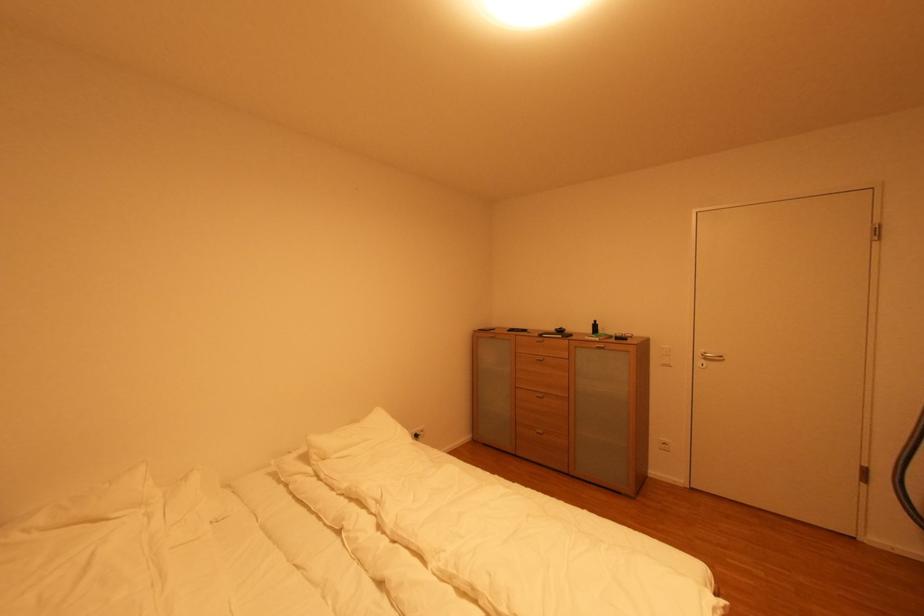
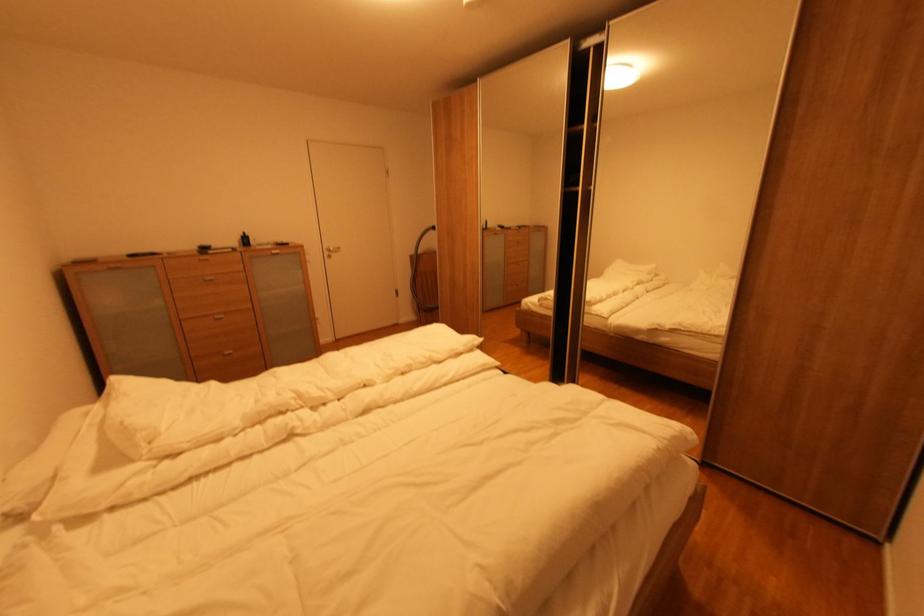
Where in the second image is the point corresponding to point (599, 323) from the first image?

(248, 237)